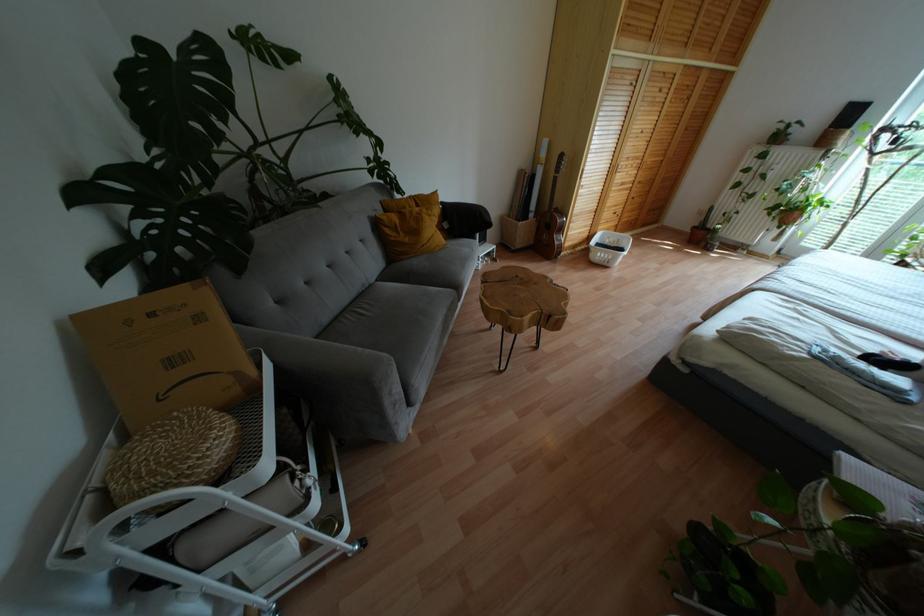
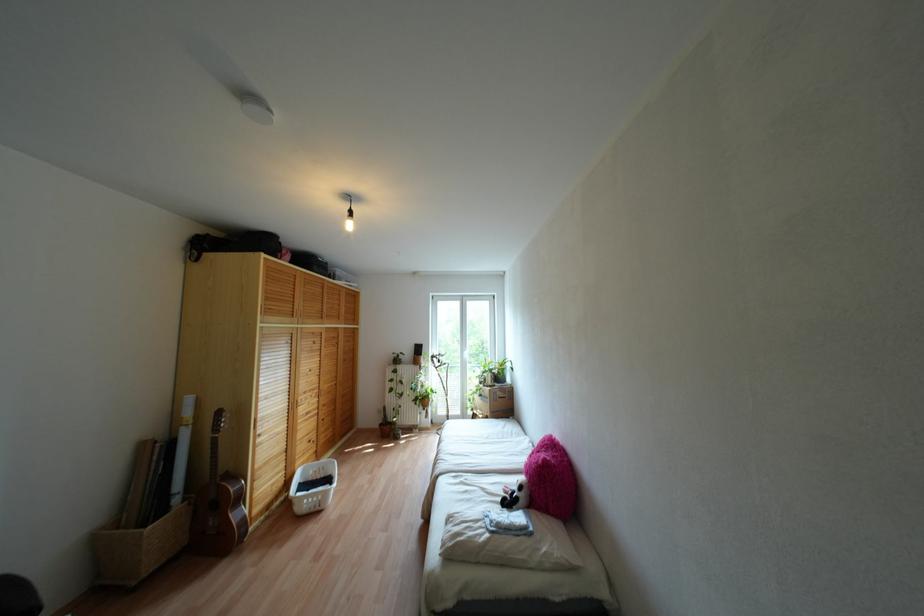
The point at (567,233) is marked in the first image. Where is the corresponding point in the second image?

(253, 495)